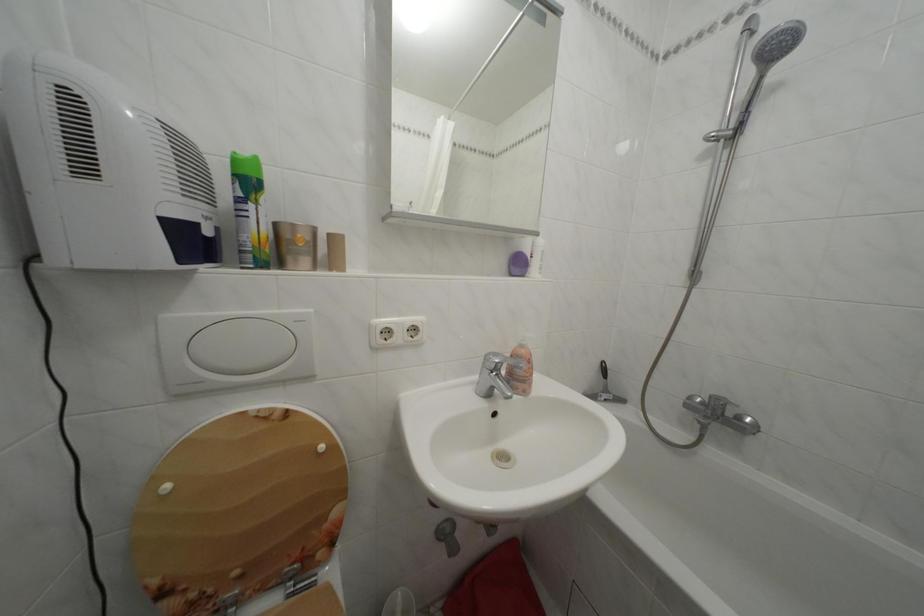
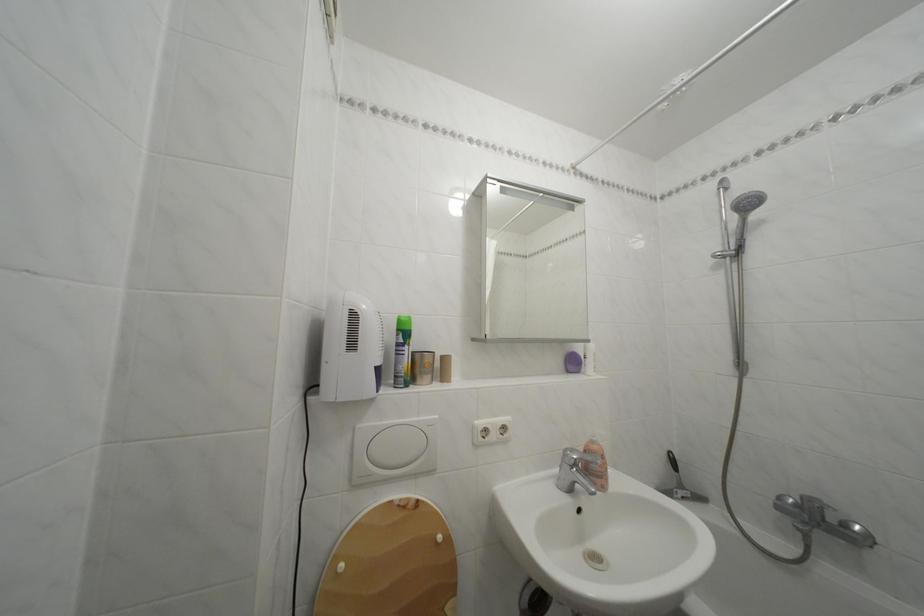
Find the pixel in the second image that matches point (530, 352) in the first image.

(602, 448)